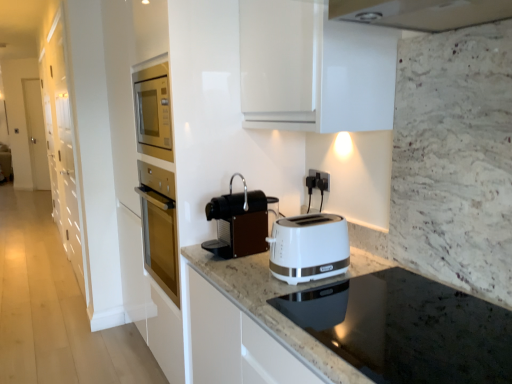
Where is `free space above black granite countertop at lower center (from a real-world perspective)`? Image resolution: width=512 pixels, height=384 pixels. free space above black granite countertop at lower center (from a real-world perspective) is located at coordinates (401, 336).